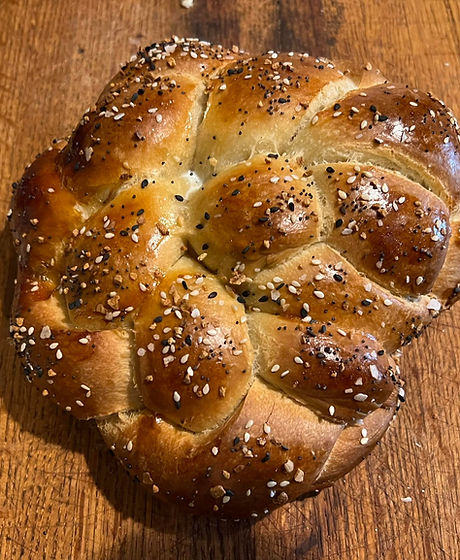
This screenshot has height=560, width=460. I want to click on bottom open space  of tabletop, lower right corner, so click(431, 443), click(412, 508), click(332, 533).